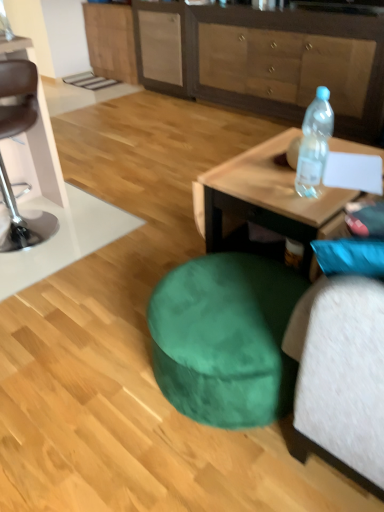
Find the location of `free space in front of matte wood cabinet at upper center, which appears as the 2th cabinetry when viewed from the front`. free space in front of matte wood cabinet at upper center, which appears as the 2th cabinetry when viewed from the front is located at coordinates (105, 91).